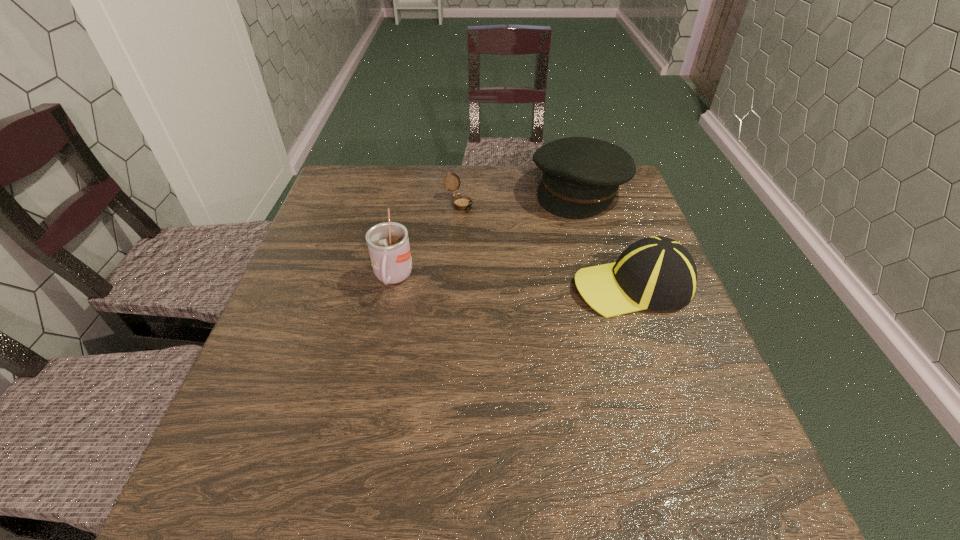
Find the location of `vacant space that satisfies the following two spatial constraints: 1. on the back side of the compass; 2. on the left side of the beret`. vacant space that satisfies the following two spatial constraints: 1. on the back side of the compass; 2. on the left side of the beret is located at coordinates (460, 190).